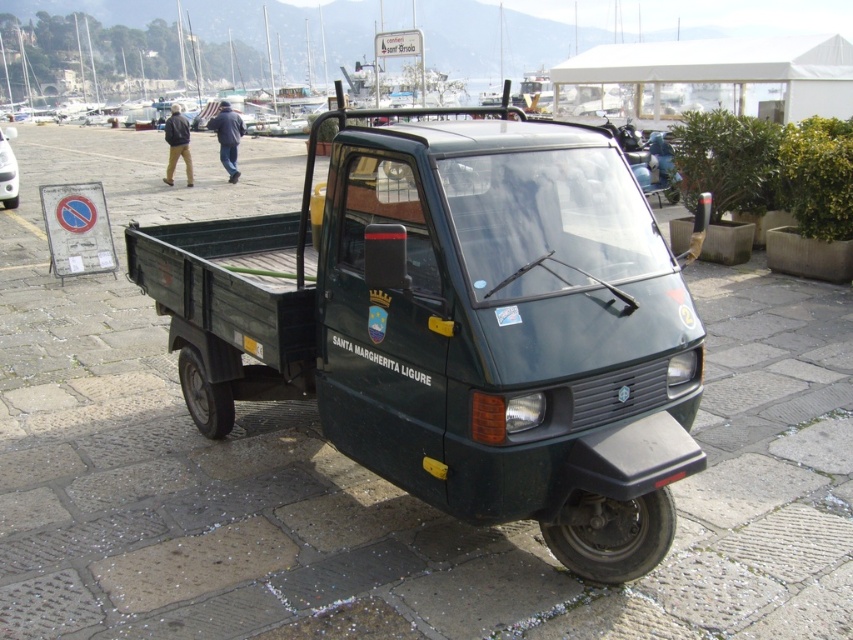
You are standing at the entrance of the marina and see the green matte pickup truck at center. If you walk straight ahead, will you reach the truck before the marina edge?

A: The green matte pickup truck at center is located at point (457, 326), which is closer to the entrance than the marina edge, so yes, you will reach the truck before the marina edge.

You are standing at the edge of a marina in Santa Margherita Ligure and see both the green matte pickup truck at center and the matte green truck at center. Which one is positioned to the right?

The green matte pickup truck at center is to the right of the matte green truck at center.